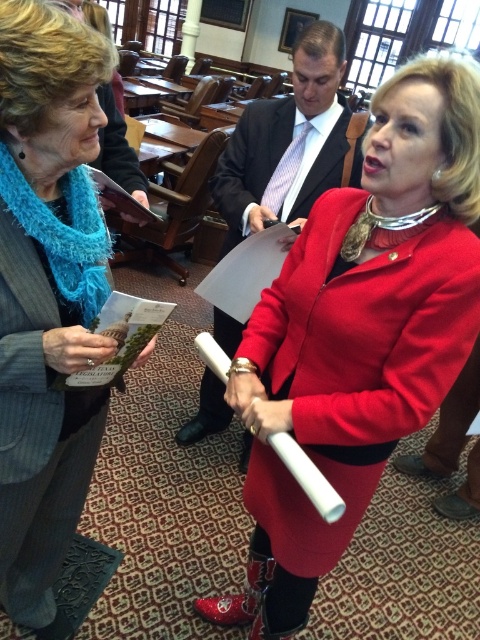
Consider the image. Can you confirm if matte red coat at center is positioned to the left of matte blue scarf at left?

Incorrect, matte red coat at center is not on the left side of matte blue scarf at left.

Between point (463, 104) and point (60, 120), which one is positioned in front?

Point (60, 120)

The image size is (480, 640). Identify the location of matte red coat at center. (359, 333).

Does matte blue scarf at left have a greater height compared to matte black suit at center?

Indeed, matte blue scarf at left has a greater height compared to matte black suit at center.

The image size is (480, 640). In order to click on matte blue scarf at left in this screenshot , I will do `click(48, 296)`.

Image resolution: width=480 pixels, height=640 pixels. Find the location of `matte blue scarf at left`. matte blue scarf at left is located at coordinates click(x=48, y=296).

Does matte red coat at center come in front of matte black suit at center?

That is True.

Between matte red coat at center and matte black suit at center, which one has more height?

matte red coat at center

Which is in front, point (421, 321) or point (226, 211)?

Positioned in front is point (421, 321).

Identify the location of matte red coat at center. (359, 333).